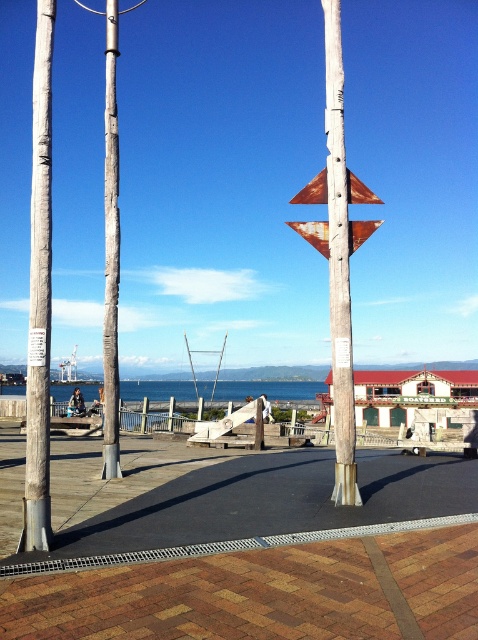
You are a photographer planning to take a photo of the waterfront scene. You want to ensure that both the weathered wood pole at left and the rusty metal triangle at center are visible in the frame. Based on their positions, which object should you place closer to the left edge of your camera frame to include both in the shot?

You should place the weathered wood pole at left closer to the left edge of your camera frame since it is positioned to the left of the rusty metal triangle at center, ensuring both are visible in the shot.

You are a photographer trying to capture a clear photo of the rusty metal triangle at center without the weathered wood pole at left blocking it. Based on the scene description, can you position yourself in a way to achieve this?

The rusty metal triangle at center is behind the weathered wood pole at left, so you cannot position yourself to capture the rusty metal triangle at center without the weathered wood pole at left blocking it because it is obscured by the pole.

Based on the photo, you are a painter who wants to paint the weathered wood pole at left and the rusty metal triangle at center. If you have a limited amount of paint, which object should you prioritize to cover completely?

The weathered wood pole at left is bigger than the rusty metal triangle at center, so you should prioritize painting the weathered wood pole at left first to ensure it gets fully covered with the limited paint.